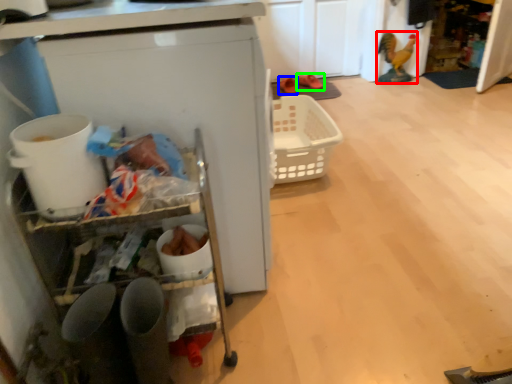
Question: Estimate the real-world distances between objects in this image. Which object is closer to toy (highlighted by a red box), footwear (highlighted by a blue box) or footwear (highlighted by a green box)?

Choices:
 (A) footwear
 (B) footwear

Answer: (B)